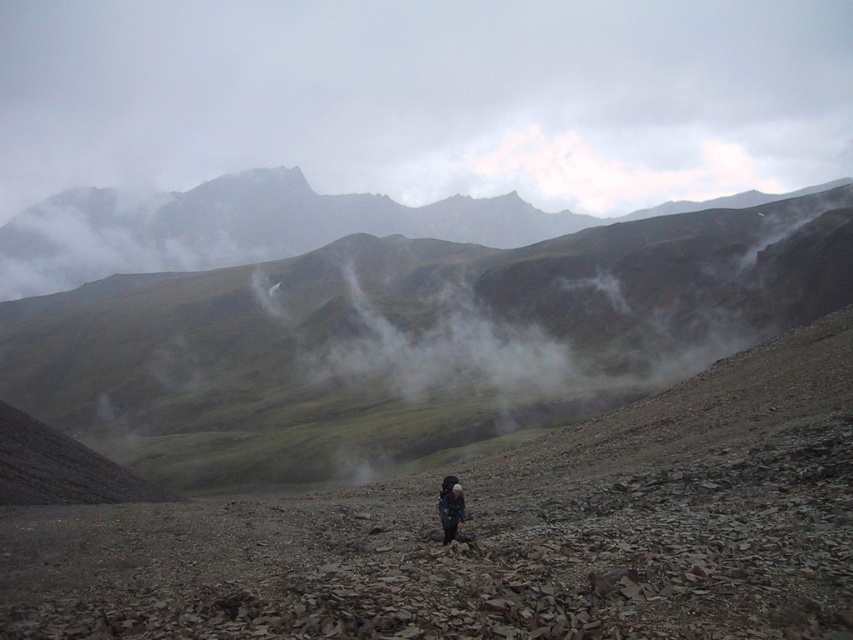
You are a hiker planning to ascend the rugged brown mountain at center while carrying your dark blue fabric backpack at center. Based on the image, is the mountain higher than your backpack?

The rugged brown mountain at center is above the dark blue fabric backpack at center, so yes, the mountain is higher than the backpack.

You are a hiker planning to climb the rugged brown mountain at center while carrying the dark blue fabric backpack at center. Considering their sizes, will the backpack be a significant burden in terms of visibility while climbing?

The rugged brown mountain at center is larger than the dark blue fabric backpack at center, so the backpack will not be a significant burden in terms of visibility while climbing.